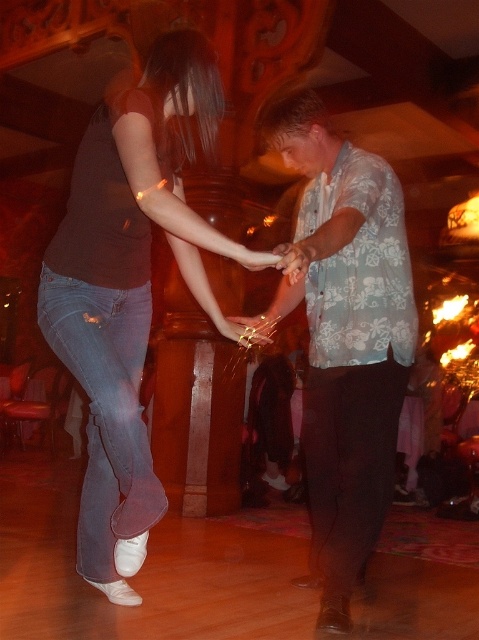
Question: Can you confirm if denim jeans at center is positioned below metallic ring at center?

Choices:
 (A) no
 (B) yes

Answer: (A)

Question: Based on their relative distances, which object is nearer to the denim at left?

Choices:
 (A) metallic ring at center
 (B) denim jeans at center
 (C) floral print shirt at center

Answer: (B)

Question: Which of the following is the farthest from the observer?

Choices:
 (A) denim at left
 (B) floral print shirt at center
 (C) metallic ring at center
 (D) denim jeans at center

Answer: (C)

Question: From the image, what is the correct spatial relationship of floral print shirt at center in relation to metallic ring at center?

Choices:
 (A) below
 (B) above

Answer: (A)

Question: Which point is closer to the camera?

Choices:
 (A) (143, 108)
 (B) (239, 317)
 (C) (125, 515)

Answer: (A)

Question: Can you confirm if denim jeans at center is wider than floral print shirt at center?

Choices:
 (A) no
 (B) yes

Answer: (B)